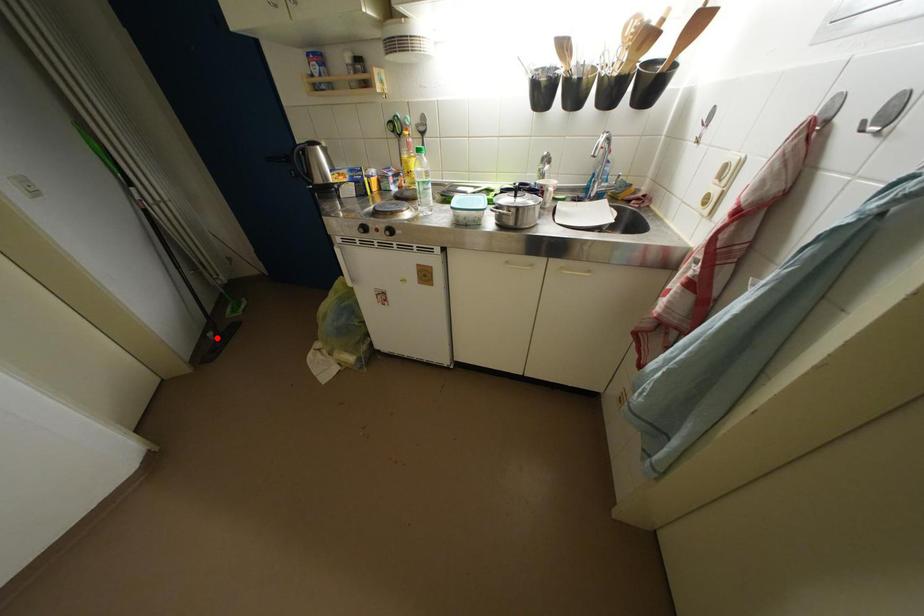
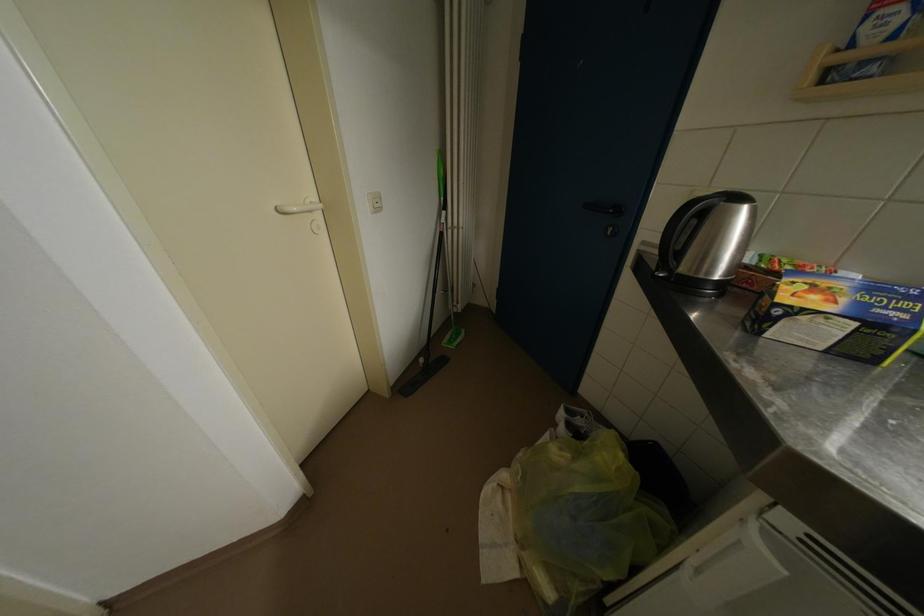
Find the pixel in the second image that matches the highlighted location in the first image.

(429, 363)